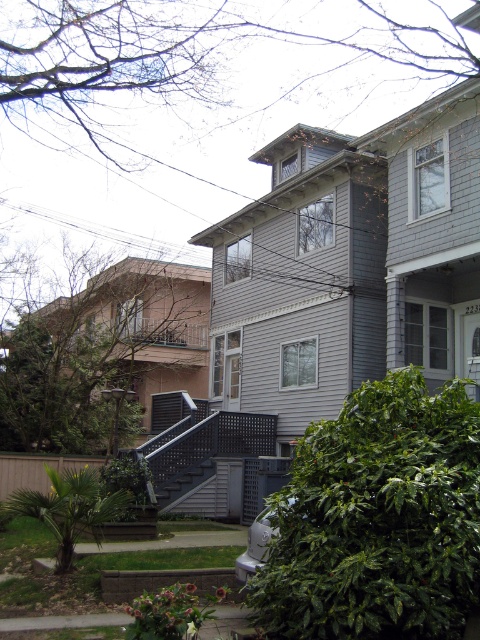
The width and height of the screenshot is (480, 640). Describe the element at coordinates (255, 545) in the screenshot. I see `silver metallic car at lower center` at that location.

Which is in front, point (249, 540) or point (157, 502)?

Point (249, 540) is more forward.

Which is in front, point (240, 573) or point (168, 484)?

Point (240, 573) is more forward.

At what (x,y) coordinates should I click in order to perform the action: click on silver metallic car at lower center. Please return your answer as a coordinate pair (x, y). This screenshot has width=480, height=640. Looking at the image, I should click on (255, 545).